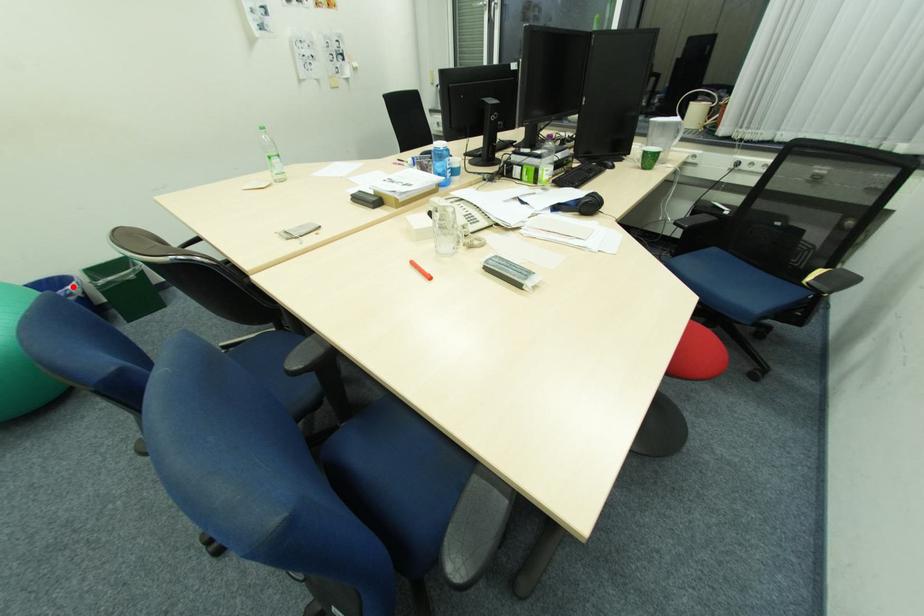
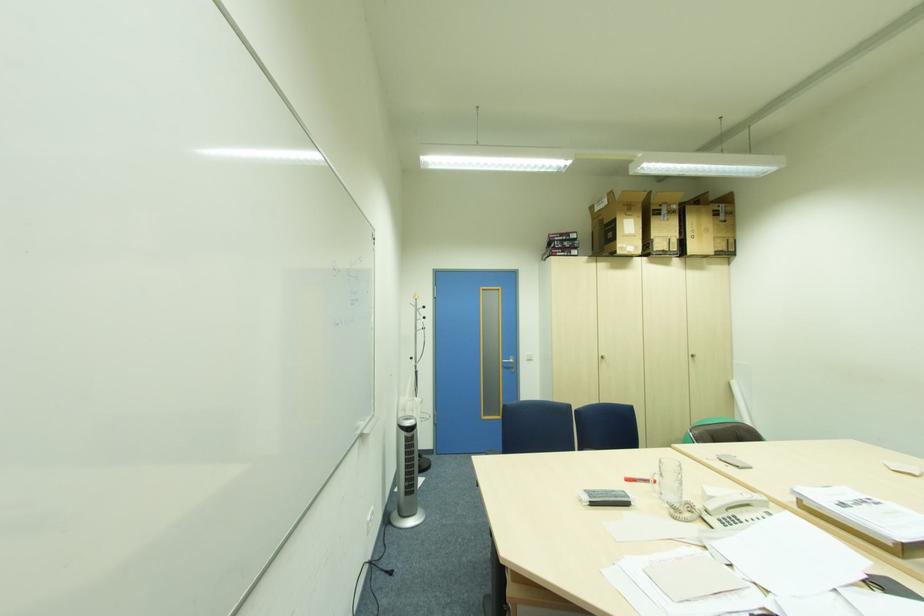
Question: I am providing you with two images of the same scene from different viewpoints. A red point is marked on the first image. At the location where the point appears in image 1, is it still visible in image 2?

Choices:
 (A) Yes
 (B) No

Answer: (B)